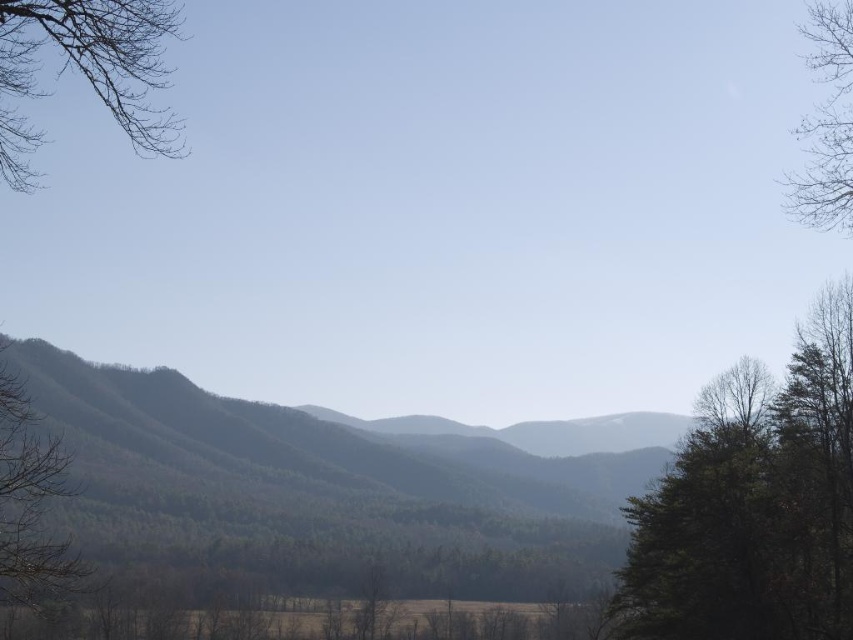
You are standing at the point with coordinates point (827, 140) and want to walk to the point with coordinates point (241, 561). Based on the scene, will the path between these two points be obstructed by any trees or shrubs in the foreground?

The point (241, 561) is behind point (827, 140), so the path between them may be obstructed by the trees and shrubs in the foreground which are located closer to the viewer than point (241, 561).

You are a hiker standing at the center of the landscape. You want to take a photo of both the green matte tree at left and the bare branches at upper right in the same frame. Which object should you focus on first to ensure both are in focus?

You should focus on the green matte tree at left first because it is closer to the viewer than the bare branches at upper right. By focusing on the closer object, you can ensure that both are within the depth of field.